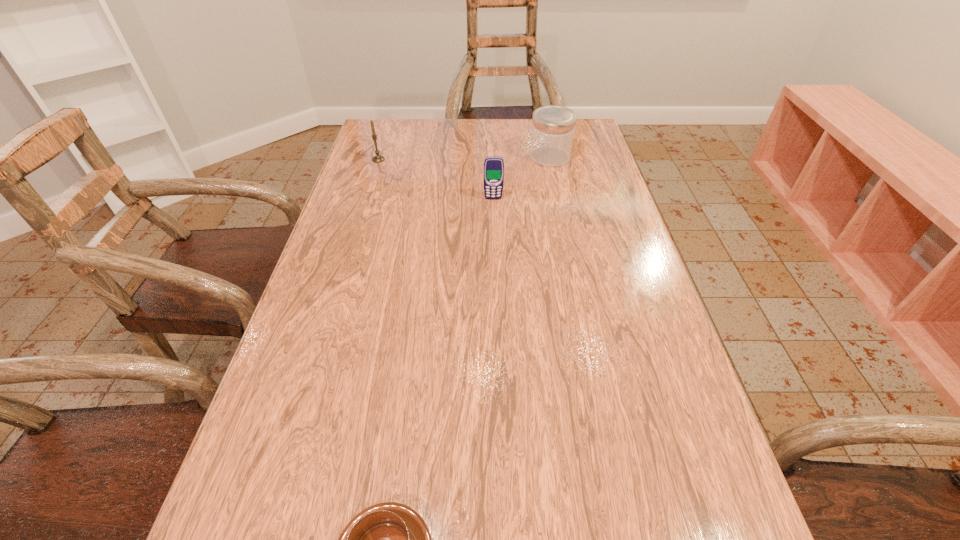
Identify the location of vacant area that lies between the third object from left to right and the rightmost object. The width and height of the screenshot is (960, 540). (521, 178).

The height and width of the screenshot is (540, 960). I want to click on object that is the second closest to the leftmost object, so click(x=553, y=127).

What are the coordinates of `object that is the closest to the cappuccino` in the screenshot? It's located at (493, 166).

Find the location of a particular element. Image resolution: width=960 pixels, height=540 pixels. free region that satisfies the following two spatial constraints: 1. on the back side of the jar; 2. on the right side of the leftmost object is located at coordinates (379, 157).

What are the coordinates of `free space in the image that satisfies the following two spatial constraints: 1. on the back side of the rightmost object; 2. on the right side of the leftmost object` in the screenshot? It's located at (379, 157).

Image resolution: width=960 pixels, height=540 pixels. In order to click on free space that satisfies the following two spatial constraints: 1. on the back side of the jar; 2. on the right side of the candle in this screenshot , I will do `click(379, 157)`.